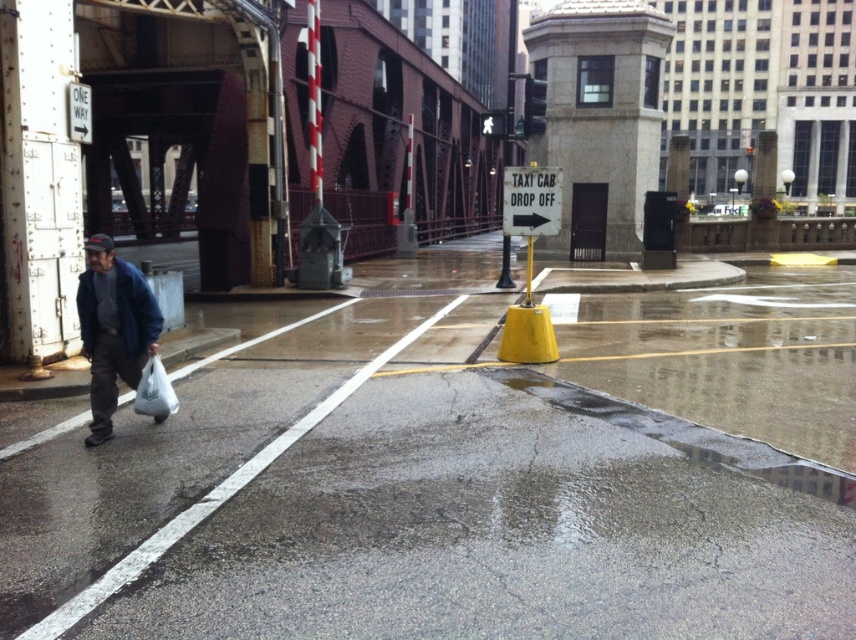
You are standing at the point closer to the viewer between point (56, 400) and point (170, 392). Which point are you at?

You are at point (56, 400) because it is further to the viewer than point (170, 392).

You are a delivery person standing at the edge of the road. You need to cross the street to deliver a package to the building on the other side. The concrete wet pavement at lower left is part of the road you must cross. Given that the average walking speed is 3 feet per second, how many seconds will it take you to cross this section of the road?

The concrete wet pavement at lower left is 12.23 feet away from the viewer. At an average walking speed of 3 feet per second, it would take approximately 4.08 seconds to cross this section of the road.

You are a delivery person trying to avoid puddles on the concrete wet pavement at lower left. Based on the scene description, where exactly is the concrete wet pavement located in the image?

The concrete wet pavement at lower left is located at point (458, 470) according to the image coordinates provided in the description.